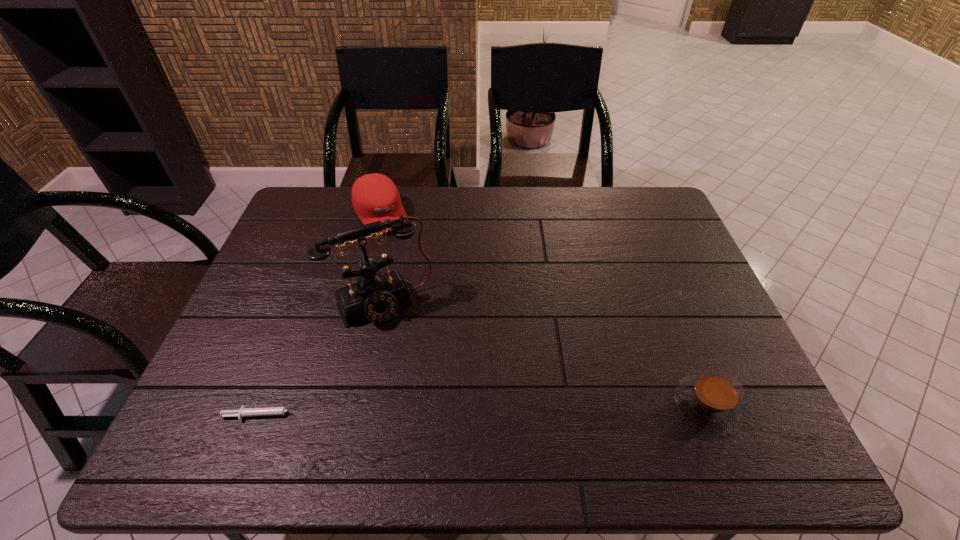
You are a GUI agent. You are given a task and a screenshot of the screen. Output one action in this format:
    pyautogui.click(x=<x>, y=<y>)
    Task: Click on the free space between the farthest object and the third tallest object
    
    Given the screenshot: What is the action you would take?
    pyautogui.click(x=543, y=310)

Where is `blank region between the second shortest object and the second farthest object`? blank region between the second shortest object and the second farthest object is located at coordinates (544, 355).

This screenshot has width=960, height=540. Identify the location of vacant point located between the shortest object and the rightmost object. (486, 410).

You are a GUI agent. You are given a task and a screenshot of the screen. Output one action in this format:
    pyautogui.click(x=<x>, y=<y>)
    Task: Click on the empty space between the farthest object and the rightmost object
    This screenshot has height=540, width=960.
    Given the screenshot: What is the action you would take?
    pyautogui.click(x=543, y=310)

Locate which object ranks third in proximity to the second tallest object. Please provide its 2D coordinates. Your answer should be formatted as a tuple, i.e. [(x, y)], where the tuple contains the x and y coordinates of a point satisfying the conditions above.

[(712, 400)]

At what (x,y) coordinates should I click in order to perform the action: click on the third closest object to the rightmost object. Please return your answer as a coordinate pair (x, y). Looking at the image, I should click on (375, 197).

Where is `vacant space that satisfies the following two spatial constraints: 1. on the front side of the farthest object; 2. on the right side of the second shortest object`? The image size is (960, 540). vacant space that satisfies the following two spatial constraints: 1. on the front side of the farthest object; 2. on the right side of the second shortest object is located at coordinates (332, 406).

At what (x,y) coordinates should I click in order to perform the action: click on vacant space that satisfies the following two spatial constraints: 1. on the front side of the telephone; 2. on the left side of the rightmost object. Please return your answer as a coordinate pair (x, y). Looking at the image, I should click on (361, 406).

Find the location of a particular element. The width and height of the screenshot is (960, 540). free region that satisfies the following two spatial constraints: 1. on the front side of the farthest object; 2. on the right side of the second farthest object is located at coordinates (358, 303).